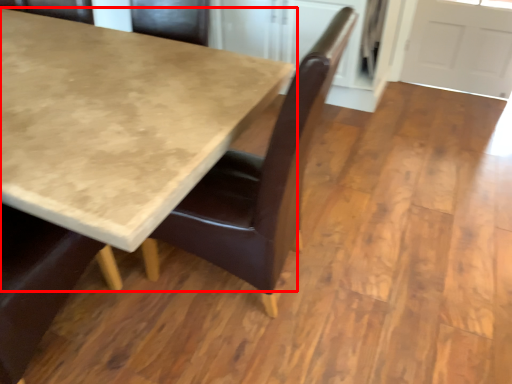
Question: From the image, what is the correct spatial relationship of table (annotated by the red box) in relation to chair?

Choices:
 (A) left
 (B) right

Answer: (A)